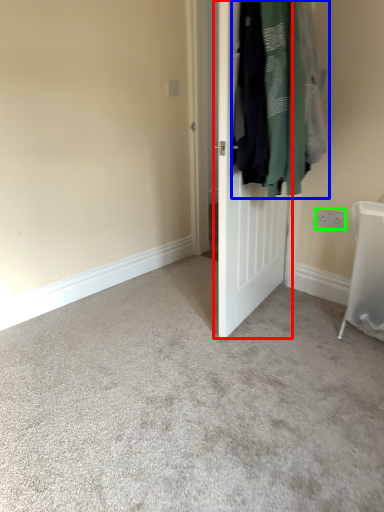
Question: Which object is positioned closest to door (highlighted by a red box)? Select from laundry (highlighted by a blue box) and electric outlet (highlighted by a green box).

Choices:
 (A) laundry
 (B) electric outlet

Answer: (A)